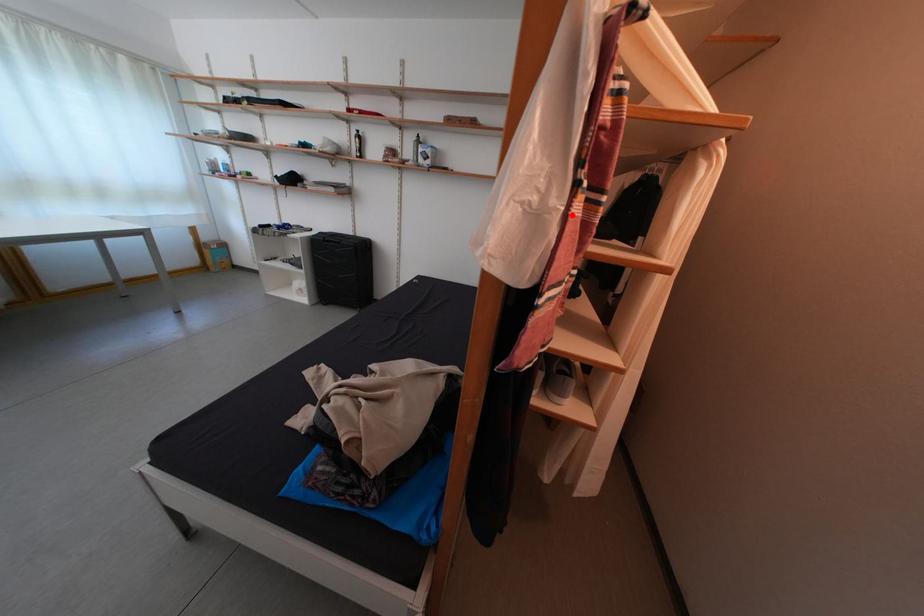
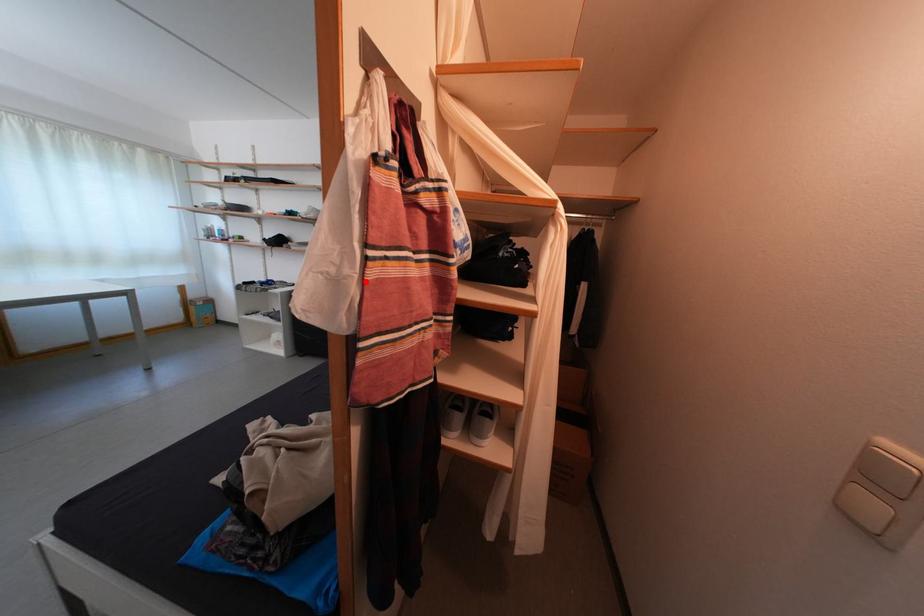
I am providing you with two images of the same scene from different viewpoints. A red point is marked on the first image and another point is marked on the second image. Is the marked point in image1 the same physical position as the marked point in image2?

Yes